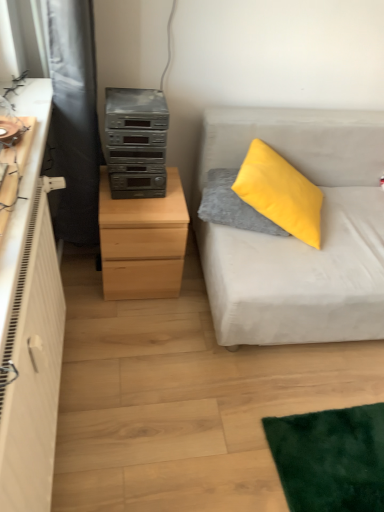
Question: In the image, is black fabric curtain at left positioned in front of or behind light wood chest of drawers at left?

Choices:
 (A) front
 (B) behind

Answer: (A)

Question: Visually, is black fabric curtain at left positioned to the left or to the right of light wood chest of drawers at left?

Choices:
 (A) right
 (B) left

Answer: (B)

Question: Which object is positioned closest to the yellow fuzzy pillow at upper right?

Choices:
 (A) black fabric curtain at left
 (B) satin silver stereo at center left
 (C) light wood chest of drawers at left
 (D) light gray fabric couch at right

Answer: (D)

Question: Which is farther from the yellow fuzzy pillow at upper right?

Choices:
 (A) light gray fabric couch at right
 (B) satin silver stereo at center left
 (C) black fabric curtain at left
 (D) light wood chest of drawers at left

Answer: (C)